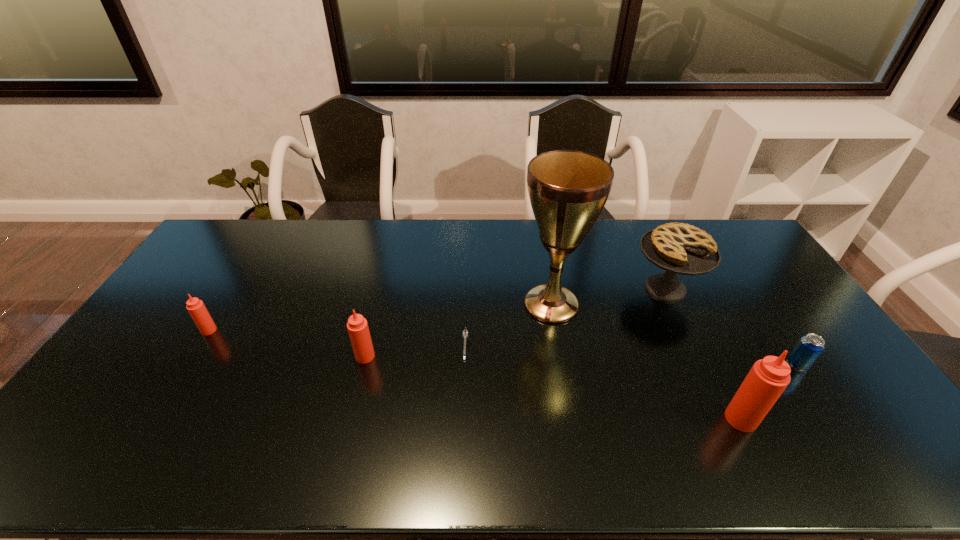
I want to click on the leftmost Tabasco sauce, so pos(196,308).

Where is `the leftmost object`? Image resolution: width=960 pixels, height=540 pixels. the leftmost object is located at coordinates (196, 308).

The height and width of the screenshot is (540, 960). Find the location of `the second Tabasco sauce from left to right`. the second Tabasco sauce from left to right is located at coordinates point(357,325).

Locate an element on the screen. The width and height of the screenshot is (960, 540). the second tallest Tabasco sauce is located at coordinates (357, 325).

Where is `the tallest Tabasco sauce`? This screenshot has width=960, height=540. the tallest Tabasco sauce is located at coordinates (768, 378).

Locate an element on the screen. the nearest Tabasco sauce is located at coordinates tap(768, 378).

At what (x,y) coordinates should I click in order to perform the action: click on pie. Please return your answer as a coordinate pair (x, y). The height and width of the screenshot is (540, 960). Looking at the image, I should click on (678, 248).

At what (x,y) coordinates should I click in order to perform the action: click on pistol. Please return your answer as a coordinate pair (x, y). The width and height of the screenshot is (960, 540). Looking at the image, I should click on (465, 333).

Locate an element on the screen. The width and height of the screenshot is (960, 540). the shortest object is located at coordinates (465, 333).

Find the location of `the fourth object from left to right`. the fourth object from left to right is located at coordinates (568, 189).